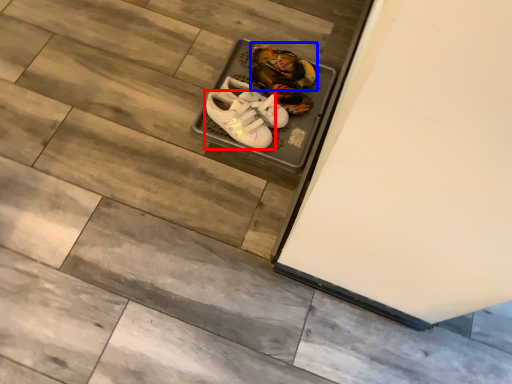
Question: Which object appears closest to the camera in this image, footwear (highlighted by a red box) or footwear (highlighted by a blue box)?

Choices:
 (A) footwear
 (B) footwear

Answer: (A)